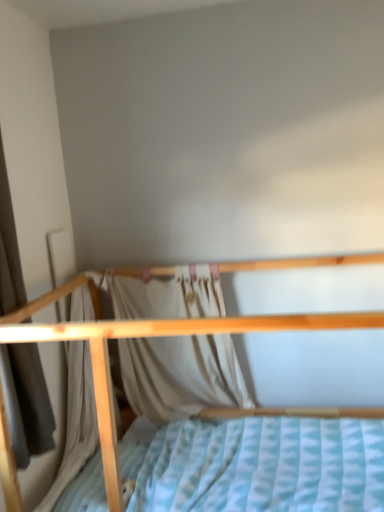
Question: Considering the relative positions of white fabric curtain at center, which is the 1th curtain in right-to-left order, and wooden bed at center in the image provided, is white fabric curtain at center, which is the 1th curtain in right-to-left order, to the left or to the right of wooden bed at center?

Choices:
 (A) left
 (B) right

Answer: (A)

Question: From the image's perspective, is white fabric curtain at center, which is the 1th curtain in right-to-left order, positioned above or below wooden bed at center?

Choices:
 (A) above
 (B) below

Answer: (A)

Question: Which of these objects is positioned farthest from the white fabric curtain at center, the second curtain when ordered from front to back?

Choices:
 (A) light beige fabric curtain at left, which is the second curtain from back to front
 (B) wooden bed at center

Answer: (A)

Question: Estimate the real-world distances between objects in this image. Which object is farther from the white fabric curtain at center, which ranks as the first curtain in back-to-front order?

Choices:
 (A) wooden bed at center
 (B) light beige fabric curtain at left, which ranks as the first curtain in front-to-back order

Answer: (B)